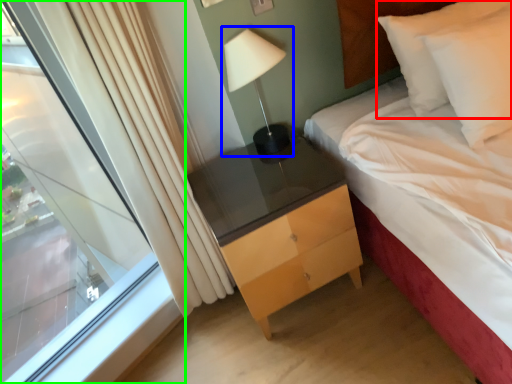
Question: Considering the real-world distances, which object is farthest from pillow (highlighted by a red box)? bedside lamp (highlighted by a blue box) or window (highlighted by a green box)?

Choices:
 (A) bedside lamp
 (B) window

Answer: (B)